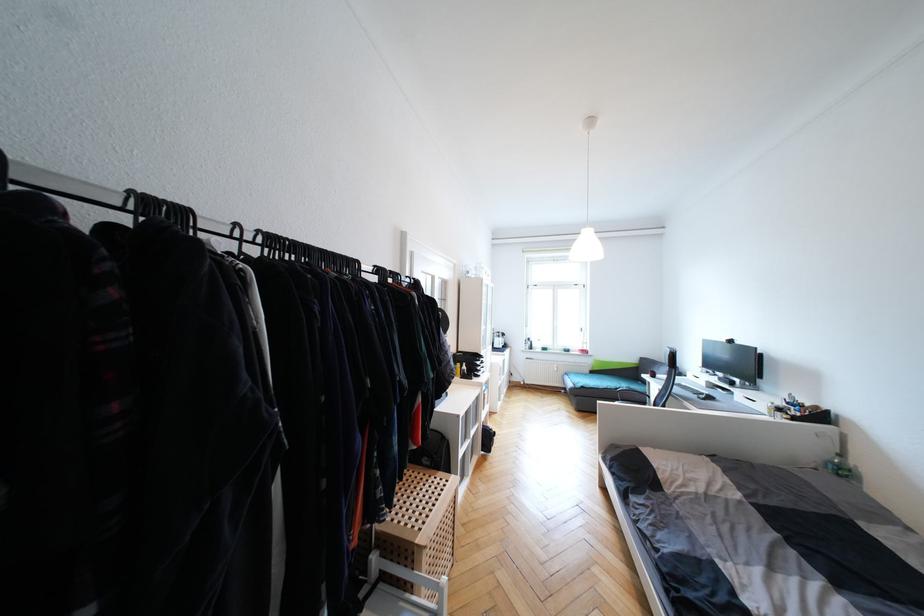
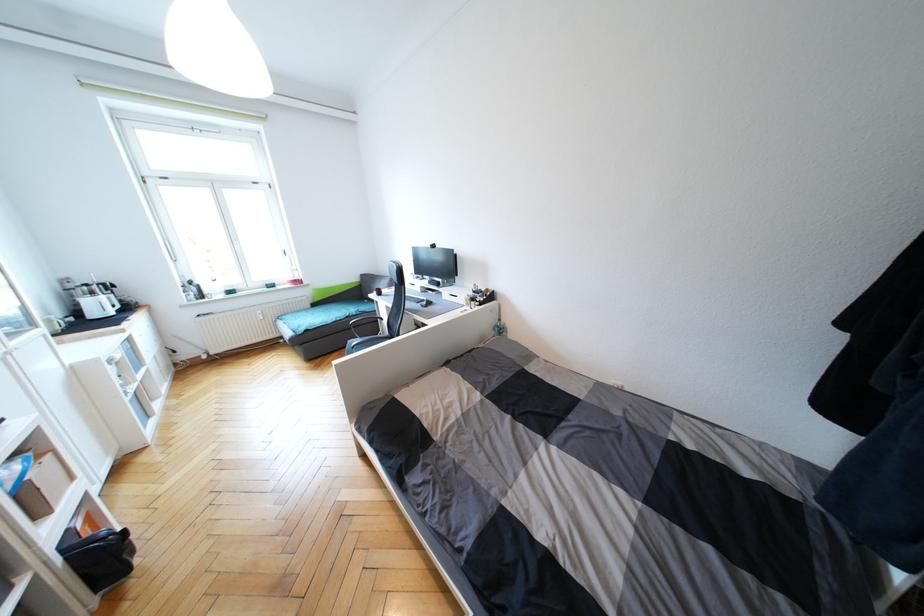
Where in the second image is the point corresponding to point (502, 338) from the first image?

(95, 294)